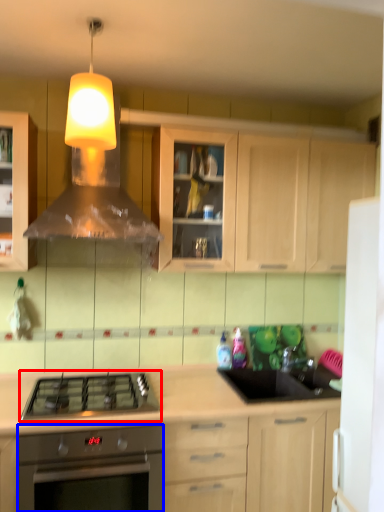
Question: Which of the following is the closest to the observer, gas stove (highlighted by a red box) or oven (highlighted by a blue box)?

Choices:
 (A) gas stove
 (B) oven

Answer: (B)